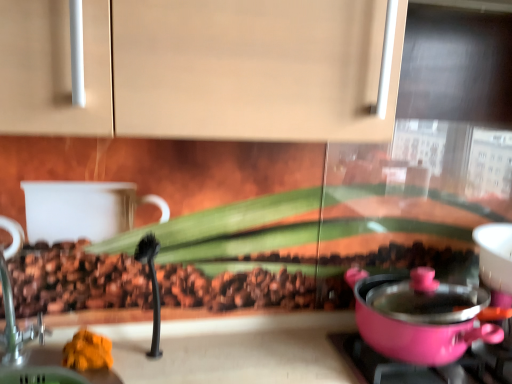
Question: Considering the relative sizes of orange soft food at lower left and pink plastic pot at lower right in the image provided, is orange soft food at lower left thinner than pink plastic pot at lower right?

Choices:
 (A) no
 (B) yes

Answer: (B)

Question: Can you confirm if orange soft food at lower left is shorter than pink plastic pot at lower right?

Choices:
 (A) no
 (B) yes

Answer: (B)

Question: Is orange soft food at lower left smaller than pink plastic pot at lower right?

Choices:
 (A) yes
 (B) no

Answer: (A)

Question: Is orange soft food at lower left positioned before pink plastic pot at lower right?

Choices:
 (A) no
 (B) yes

Answer: (A)

Question: From a real-world perspective, is orange soft food at lower left physically above pink plastic pot at lower right?

Choices:
 (A) yes
 (B) no

Answer: (A)

Question: From a real-world perspective, does orange soft food at lower left sit lower than pink plastic pot at lower right?

Choices:
 (A) no
 (B) yes

Answer: (A)

Question: Are pink plastic pot at lower right and orange soft food at lower left beside each other?

Choices:
 (A) yes
 (B) no

Answer: (B)

Question: Is pink plastic pot at lower right further to camera compared to orange soft food at lower left?

Choices:
 (A) no
 (B) yes

Answer: (A)

Question: Could you tell me if pink plastic pot at lower right is turned towards orange soft food at lower left?

Choices:
 (A) yes
 (B) no

Answer: (B)

Question: Is pink plastic pot at lower right facing away from orange soft food at lower left?

Choices:
 (A) no
 (B) yes

Answer: (A)

Question: From a real-world perspective, is pink plastic pot at lower right positioned under orange soft food at lower left based on gravity?

Choices:
 (A) yes
 (B) no

Answer: (A)

Question: Considering the relative sizes of pink plastic pot at lower right and orange soft food at lower left in the image provided, is pink plastic pot at lower right bigger than orange soft food at lower left?

Choices:
 (A) no
 (B) yes

Answer: (B)

Question: Is pink plastic pot at right turned away from orange soft food at lower left?

Choices:
 (A) yes
 (B) no

Answer: (B)